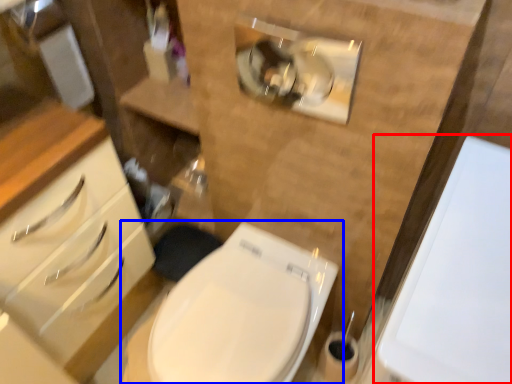
Question: Which of the following is the closest to the observer, porcelain (highlighted by a red box) or toilet (highlighted by a blue box)?

Choices:
 (A) porcelain
 (B) toilet

Answer: (A)